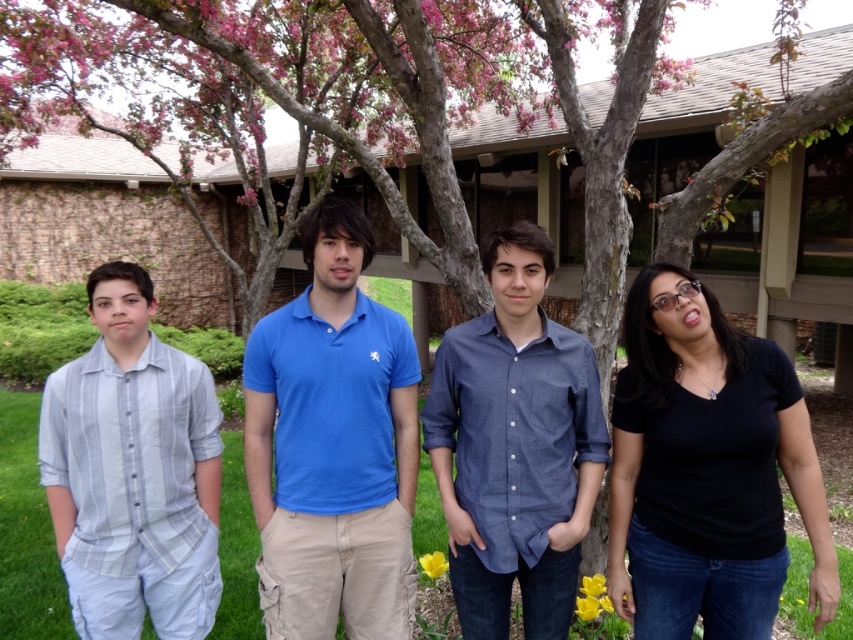
You are standing in front of the building with the brick wall and wooden beams. There is a point marked at coordinates (334, 445). What is the significance of this point?

The point at coordinates (334, 445) marks the location of the blue cotton polo shirt at center.

You are a photographer standing between the black matte shirt at right and the light blue striped shirt at left. You need to ensure that both subjects are in focus. If your camera has a depth of field range of 5 feet, will both subjects be in focus?

The distance between the black matte shirt at right and the light blue striped shirt at left is 5.83 feet. Since the depth of field range is 5 feet, which is less than the distance between them, both subjects cannot be in focus simultaneously.